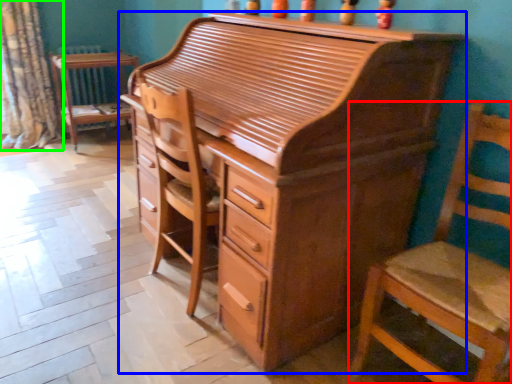
Question: Based on their relative distances, which object is nearer to chair (highlighted by a red box)? Choose from chest of drawers (highlighted by a blue box) and curtain (highlighted by a green box).

Choices:
 (A) chest of drawers
 (B) curtain

Answer: (A)